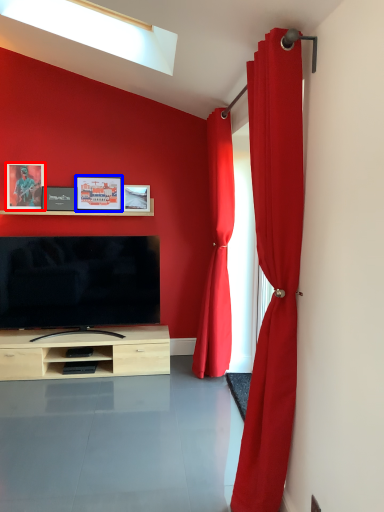
Question: Which object is closer to the camera taking this photo, picture frame (highlighted by a red box) or picture frame (highlighted by a blue box)?

Choices:
 (A) picture frame
 (B) picture frame

Answer: (A)